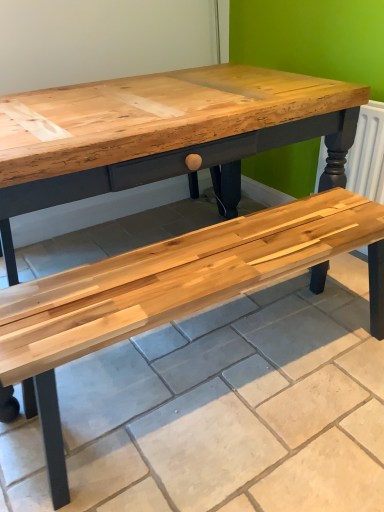
The image size is (384, 512). I want to click on natural wood bench at lower center, so click(174, 292).

What is the approximate height of natural wood bench at lower center?

It is 4.26 centimeters.

Describe the element at coordinates (174, 292) in the screenshot. I see `natural wood bench at lower center` at that location.

Where is `natural wood bench at lower center`? The width and height of the screenshot is (384, 512). natural wood bench at lower center is located at coordinates (174, 292).